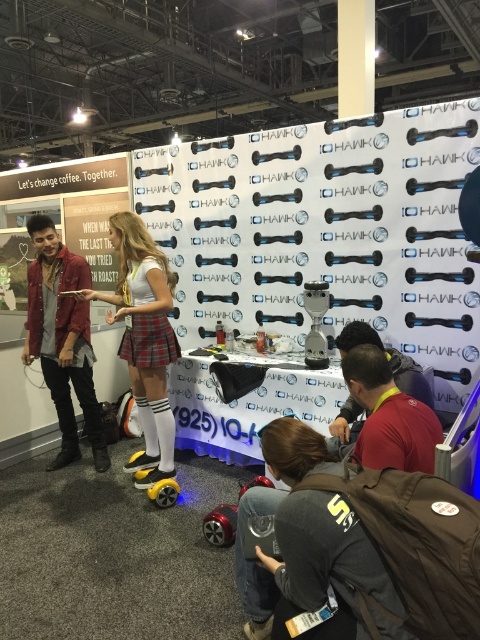
Question: Does reddish-brown leather jacket at lower right appear on the right side of dark brown leather jacket at lower right?

Choices:
 (A) yes
 (B) no

Answer: (B)

Question: Is reddish-brown leather jacket at lower right to the left of matte yellow hoverboard at center from the viewer's perspective?

Choices:
 (A) no
 (B) yes

Answer: (A)

Question: Based on their relative distances, which object is nearer to the matte yellow hoverboard at center?

Choices:
 (A) dark brown leather jacket at lower right
 (B) reddish-brown leather jacket at lower right

Answer: (A)

Question: Which point appears closest to the camera in this image?

Choices:
 (A) (384, 413)
 (B) (167, 406)
 (C) (296, 422)

Answer: (C)

Question: Which point is farther from the camera taking this photo?

Choices:
 (A) (377, 412)
 (B) (128, 305)

Answer: (B)

Question: Is reddish-brown leather jacket at lower right to the right of dark brown leather jacket at lower right from the viewer's perspective?

Choices:
 (A) no
 (B) yes

Answer: (A)